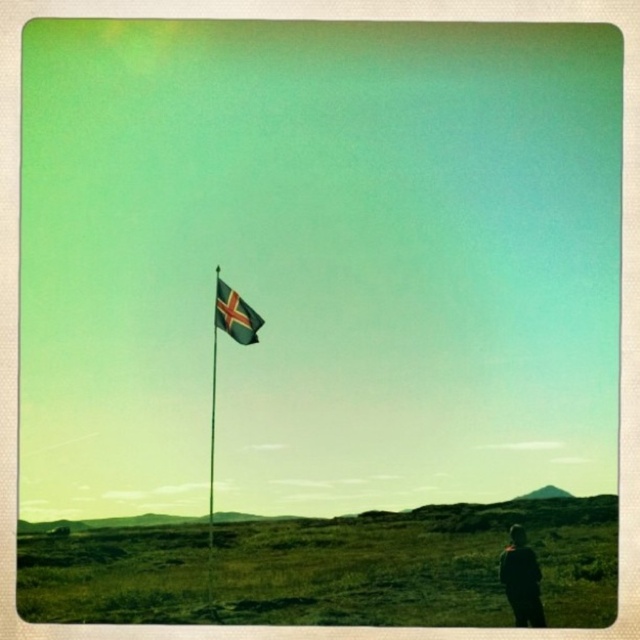
You are standing at the point marked by the coordinates in the image, which is point (236,316). You want to find the silky fabric flag at center. Which direction should you move to reach it?

The silky fabric flag at center is located at point (236,316), so you are already at the location of the silky fabric flag at center.

You are standing at the center of the image. Which direction should you face to see the silky fabric flag at center?

Since the silky fabric flag at center is located at point 0.494 on the x axis and 0.369 on the y axis, which is near the center of the image, you are already facing the direction of the silky fabric flag at center.